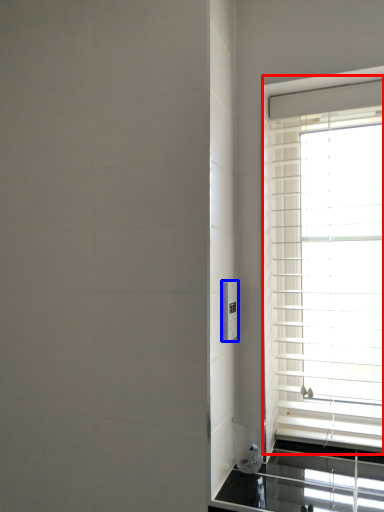
Question: Among these objects, which one is farthest to the camera, window (highlighted by a red box) or electric outlet (highlighted by a blue box)?

Choices:
 (A) window
 (B) electric outlet

Answer: (A)